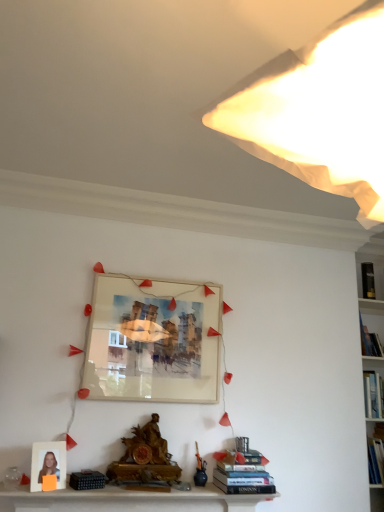
Question: Is hardcover books at lower center, which is counted as the 3th book, starting from the back, oriented towards black hardcover book at upper right, the third book viewed from the front?

Choices:
 (A) no
 (B) yes

Answer: (A)

Question: Is hardcover books at lower center, the 3th book when ordered from top to bottom, in contact with black hardcover book at upper right, the third book in the left-to-right sequence?

Choices:
 (A) no
 (B) yes

Answer: (A)

Question: Does hardcover books at lower center, which is counted as the 3th book, starting from the back, have a lesser height compared to black hardcover book at upper right, marked as the first book in a top-to-bottom arrangement?

Choices:
 (A) no
 (B) yes

Answer: (B)

Question: Does hardcover books at lower center, the first book positioned from the bottom, have a greater width compared to black hardcover book at upper right, positioned as the first book in back-to-front order?

Choices:
 (A) no
 (B) yes

Answer: (B)

Question: Considering the relative sizes of hardcover books at lower center, positioned as the 1th book in front-to-back order, and black hardcover book at upper right, marked as the first book in a top-to-bottom arrangement, in the image provided, is hardcover books at lower center, positioned as the 1th book in front-to-back order, taller than black hardcover book at upper right, marked as the first book in a top-to-bottom arrangement,?

Choices:
 (A) no
 (B) yes

Answer: (A)

Question: In terms of width, does blue hardcover book at upper right, arranged as the second book when ordered from the bottom, look wider or thinner when compared to hardcover books at lower center, the third book in the right-to-left sequence?

Choices:
 (A) wide
 (B) thin

Answer: (B)

Question: Is blue hardcover book at upper right, the second book when ordered from top to bottom, taller or shorter than hardcover books at lower center, the 3th book when ordered from top to bottom?

Choices:
 (A) short
 (B) tall

Answer: (B)

Question: Would you say blue hardcover book at upper right, the second book when ordered from top to bottom, is to the left or to the right of hardcover books at lower center, the 3th book when ordered from top to bottom, in the picture?

Choices:
 (A) left
 (B) right

Answer: (B)

Question: Do you think blue hardcover book at upper right, arranged as the second book when ordered from the bottom, is within hardcover books at lower center, the first book from the left, or outside of it?

Choices:
 (A) outside
 (B) inside

Answer: (A)

Question: Is blue hardcover book at upper right, the second book when ordered from top to bottom, wider or thinner than white paper lampshade at upper right?

Choices:
 (A) wide
 (B) thin

Answer: (B)

Question: Choose the correct answer: Is blue hardcover book at upper right, the second book when ordered from top to bottom, inside white paper lampshade at upper right or outside it?

Choices:
 (A) inside
 (B) outside

Answer: (B)

Question: Is point click(375, 347) closer or farther from the camera than point click(382, 202)?

Choices:
 (A) closer
 (B) farther

Answer: (B)

Question: From a real-world perspective, is blue hardcover book at upper right, which appears as the second book when viewed from the back, above or below white paper lampshade at upper right?

Choices:
 (A) above
 (B) below

Answer: (B)

Question: Would you say hardcover books at lower center, positioned as the 1th book in front-to-back order, is to the left or to the right of white paper lampshade at upper right in the picture?

Choices:
 (A) left
 (B) right

Answer: (B)

Question: Considering their positions, is hardcover books at lower center, the first book positioned from the bottom, located in front of or behind white paper lampshade at upper right?

Choices:
 (A) front
 (B) behind

Answer: (B)